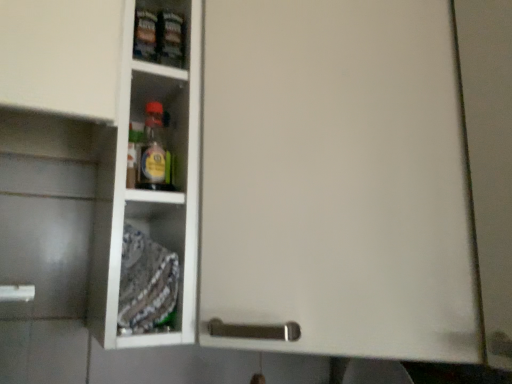
You are a GUI agent. You are given a task and a screenshot of the screen. Output one action in this format:
    pyautogui.click(x=<x>, y=<y>)
    Task: Click on the white glossy cabinet at left
    Image resolution: width=512 pixels, height=384 pixels.
    Given the screenshot: What is the action you would take?
    pyautogui.click(x=150, y=196)

The height and width of the screenshot is (384, 512). Describe the element at coordinates (150, 196) in the screenshot. I see `white glossy cabinet at left` at that location.

Measure the distance between white glossy cabinet at left and camera.

white glossy cabinet at left is 26.09 inches from camera.

Find the location of `white glossy cabinet at left`. white glossy cabinet at left is located at coordinates (150, 196).